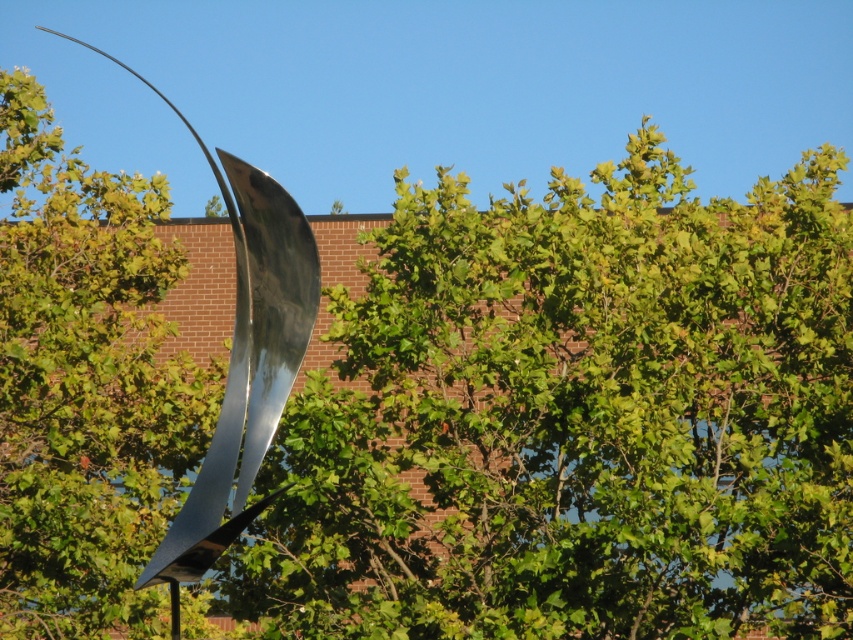
Question: Can you confirm if green leafy tree at center is positioned to the left of shiny metallic sculpture at left?

Choices:
 (A) no
 (B) yes

Answer: (A)

Question: Does green leafy tree at center appear on the right side of shiny metallic sculpture at left?

Choices:
 (A) yes
 (B) no

Answer: (A)

Question: Which object is farther from the camera taking this photo?

Choices:
 (A) shiny metallic sculpture at left
 (B) green leafy tree at center

Answer: (B)

Question: Which point is farther to the camera?

Choices:
 (A) shiny metallic sculpture at left
 (B) green leafy tree at center

Answer: (B)

Question: Which point is closer to the camera taking this photo?

Choices:
 (A) (242, 392)
 (B) (514, 266)

Answer: (A)

Question: Is green leafy tree at center to the left of shiny metallic sculpture at left from the viewer's perspective?

Choices:
 (A) yes
 (B) no

Answer: (B)